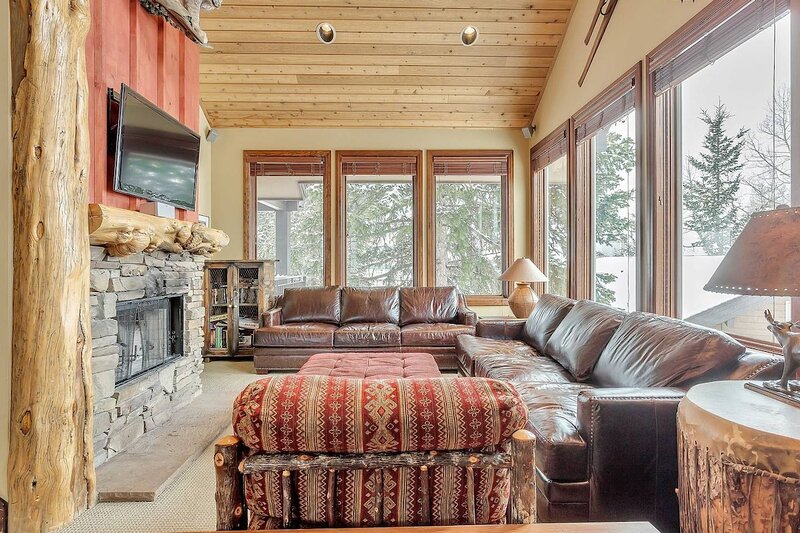
Locate an element on the screen. The image size is (800, 533). chair is located at coordinates (341, 450).